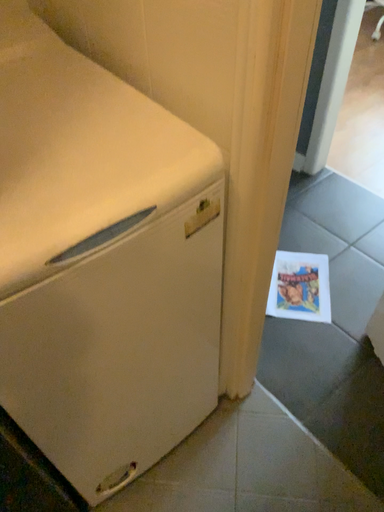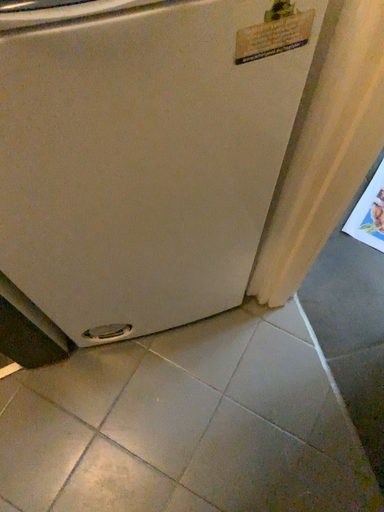
Question: Which way did the camera rotate in the video?

Choices:
 (A) rotated upward
 (B) rotated downward

Answer: (B)